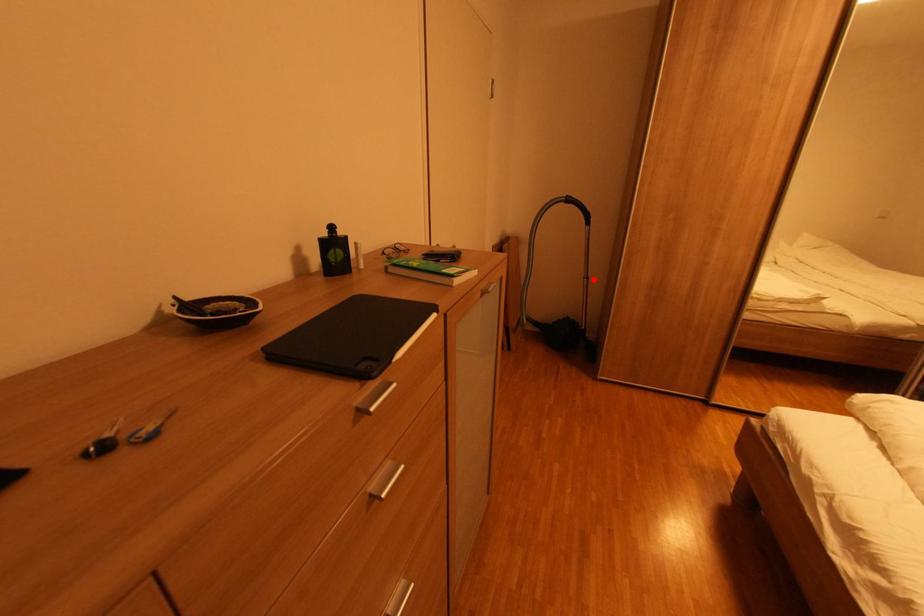
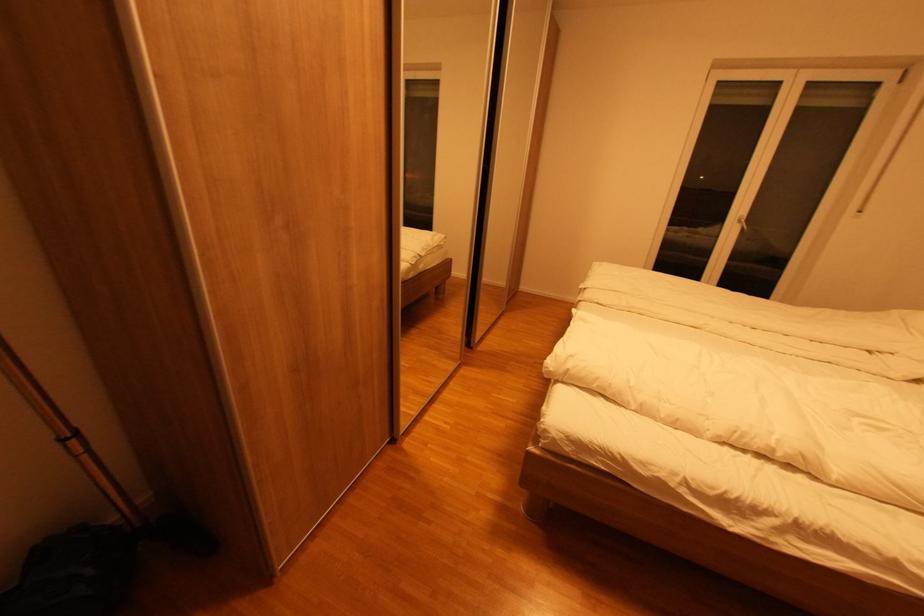
Find the pixel in the second image that matches the highlighted location in the first image.

(83, 434)